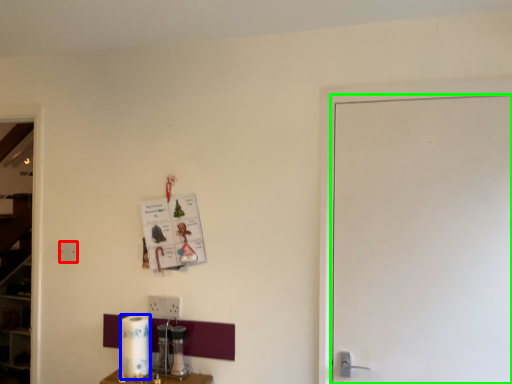
Question: Which object is positioned closest to electric outlet (highlighted by a red box)? Select from paper towel (highlighted by a blue box) and door (highlighted by a green box).

Choices:
 (A) paper towel
 (B) door

Answer: (A)